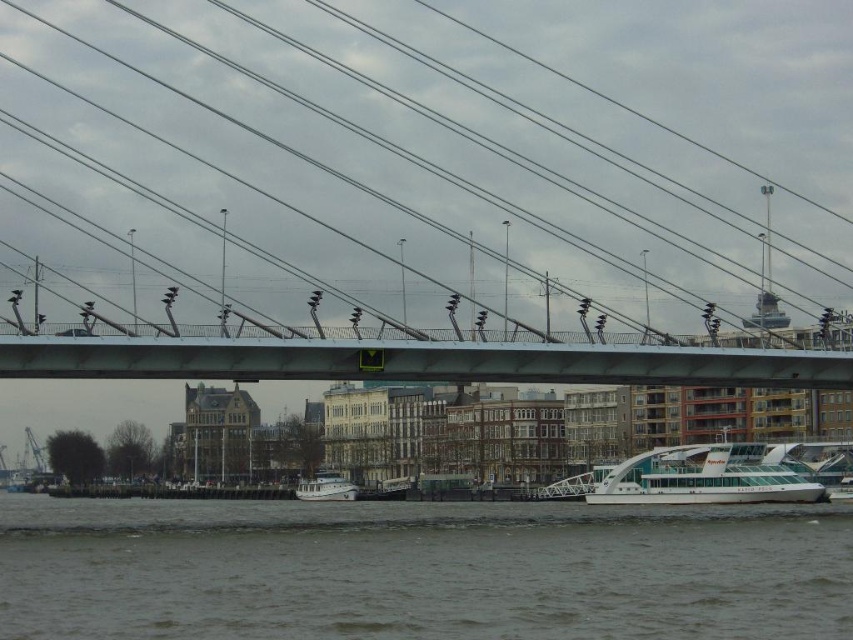
You are a photographer planning to capture the white matte boat at center and the metallic wires at center in the same frame. Based on their sizes in the image, which object would appear larger in your photograph?

The metallic wires at center is bigger than white matte boat at center, so the metallic wires at center would appear larger in the photograph.

You are a photographer planning to capture the white matte boat at center and the gray water at lower center in a single shot. Based on their sizes, which one will occupy more of the frame?

The gray water at lower center occupies more of the frame since it is larger in size than the white matte boat at center.

Consider the image. You are a photographer planning to capture the metallic wires at center and the white glossy boat at lower right in the same frame. Based on their sizes, which object should you focus on to ensure both are clearly visible in the photo?

The metallic wires at center are wider than the white glossy boat at lower right, so focusing on the metallic wires at center would help ensure both objects are clearly visible in the photo.